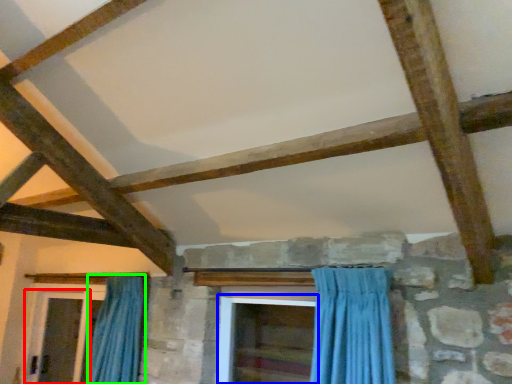
Question: Based on their relative distances, which object is farther from screen door (highlighted by a red box)? Choose from screen door (highlighted by a blue box) and curtain (highlighted by a green box).

Choices:
 (A) screen door
 (B) curtain

Answer: (A)